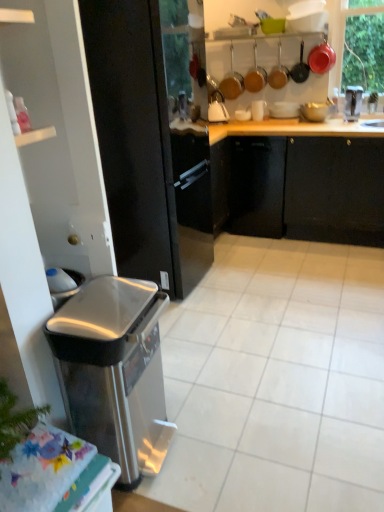
Question: In the image, is black glossy refrigerator at left on the left side or the right side of white glossy sink at upper right?

Choices:
 (A) left
 (B) right

Answer: (A)

Question: Is point (125, 248) positioned closer to the camera than point (349, 102)?

Choices:
 (A) farther
 (B) closer

Answer: (B)

Question: Which object is the farthest from the metallic copper pot at upper center, which is counted as the seventh appliance, starting from the right?

Choices:
 (A) matte white bowl at upper center, which appears as the 3th appliance when viewed from the right
 (B) metallic stainless steel faucet at upper right, which ranks as the 7th appliance in left-to-right order
 (C) matte brown pot at upper center, positioned as the 2th appliance in left-to-right order
 (D) printed fabric table at lower left
 (E) metallic black frying pan at upper right, which is the fourth appliance from right to left

Answer: (D)

Question: Which object is the closest to the matte red pot at upper right, marked as the second appliance in a right-to-left arrangement?

Choices:
 (A) white glossy shelf at upper left
 (B) metallic black frying pan at upper right, which is the fourth appliance from right to left
 (C) white glossy sink at upper right
 (D) matte brown pot at upper center, positioned as the 2th appliance in left-to-right order
 (E) matte white bowl at upper center, which is counted as the fifth appliance, starting from the left

Answer: (B)